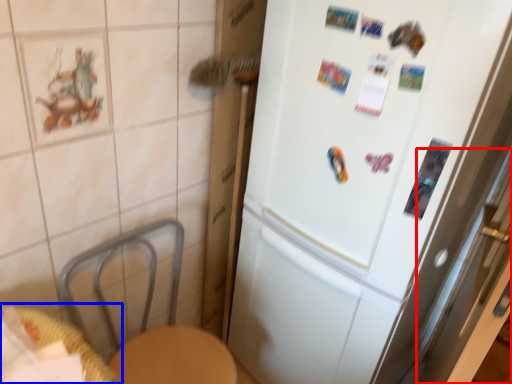
Question: Among these objects, which one is nearest to the camera, screen door (highlighted by a red box) or table (highlighted by a blue box)?

Choices:
 (A) screen door
 (B) table

Answer: (B)